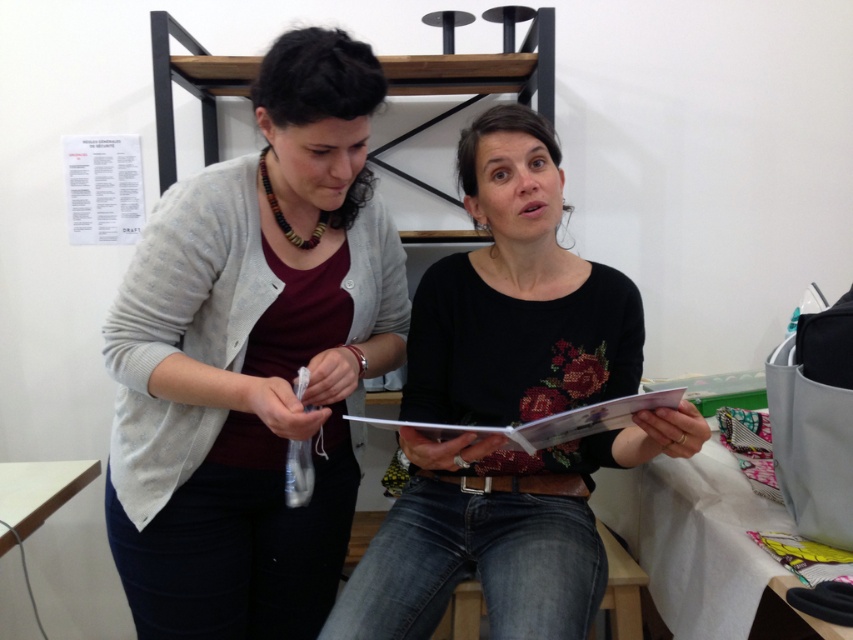
You are organizing a clothing donation drive and need to categorize items by size. You have two items in front of you, the matte gray cardigan at center and the black matte shirt at center. Based on their visual appearance in the image, which item would you classify as the larger size?

The matte gray cardigan at center has a larger size compared to the black matte shirt at center, so it should be categorized as the larger size.

Based on the scene description, which object is taller between the matte gray cardigan at center and the black matte shirt at center?

The matte gray cardigan at center is taller than the black matte shirt at center.

You are an observer in the room. You see the matte gray cardigan at center and the black matte shirt at center. Which one is positioned to the left?

The matte gray cardigan at center is to the left of the black matte shirt at center, so the matte gray cardigan at center is positioned to the left.